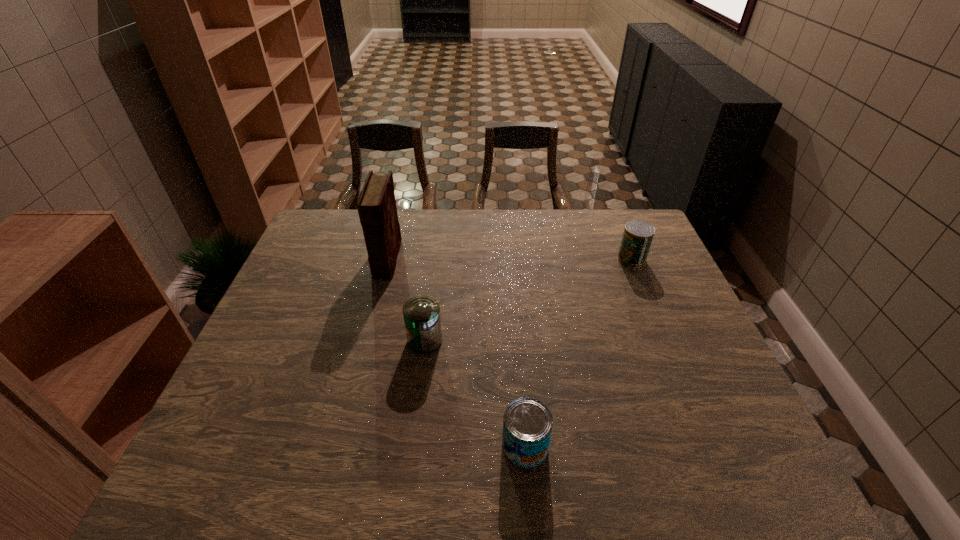
Where is `free space between the leftmost can and the rightmost object`? The height and width of the screenshot is (540, 960). free space between the leftmost can and the rightmost object is located at coordinates (528, 300).

Identify the location of object that ranks as the third closest to the second farthest can. (637, 237).

This screenshot has height=540, width=960. In order to click on the second closest object to the hardback book in this screenshot , I will do `click(527, 423)`.

Identify which can is located as the second nearest to the third farthest object. Please provide its 2D coordinates. Your answer should be formatted as a tuple, i.e. [(x, y)], where the tuple contains the x and y coordinates of a point satisfying the conditions above.

[(637, 237)]

Identify the location of can that is the nearest to the farthest can. This screenshot has width=960, height=540. pyautogui.click(x=422, y=319).

Identify the location of blank area in the image that satisfies the following two spatial constraints: 1. on the spine side of the hardback book; 2. on the right side of the second farthest can. (366, 340).

Locate an element on the screen. free location that satisfies the following two spatial constraints: 1. on the spine side of the hardback book; 2. on the left side of the nearest object is located at coordinates (340, 446).

This screenshot has width=960, height=540. I want to click on free spot that satisfies the following two spatial constraints: 1. on the spine side of the farthest can; 2. on the right side of the tallest object, so click(387, 259).

Where is `vacant space that satisfies the following two spatial constraints: 1. on the spine side of the leftmost object; 2. on the left side of the second object from left to right`? The height and width of the screenshot is (540, 960). vacant space that satisfies the following two spatial constraints: 1. on the spine side of the leftmost object; 2. on the left side of the second object from left to right is located at coordinates (366, 340).

Find the location of a particular element. vacant space that satisfies the following two spatial constraints: 1. on the spine side of the rightmost can; 2. on the right side of the tallest object is located at coordinates (387, 259).